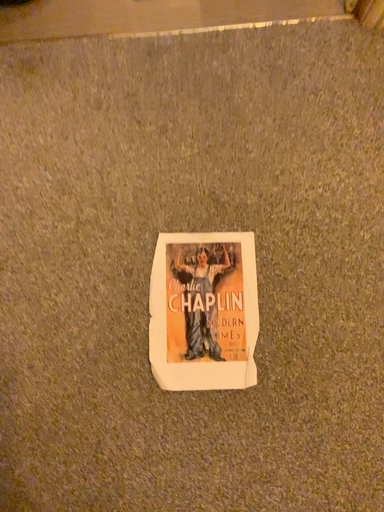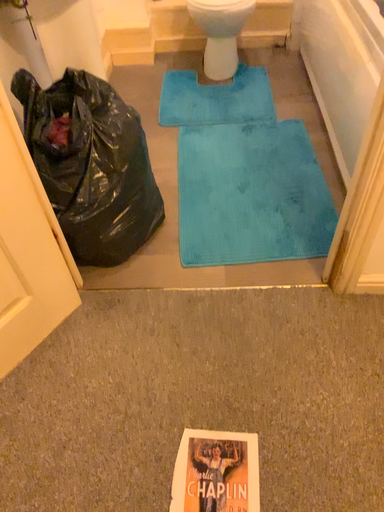
Question: How did the camera likely rotate when shooting the video?

Choices:
 (A) rotated downward
 (B) rotated upward

Answer: (B)